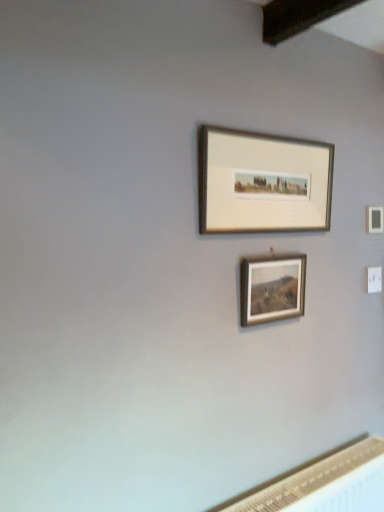
Question: Considering the relative positions of wooden frame at center, the 1th picture frame from the bottom, and silver metallic picture frame at upper center, which ranks as the second picture frame in bottom-to-top order, in the image provided, is wooden frame at center, the 1th picture frame from the bottom, to the right of silver metallic picture frame at upper center, which ranks as the second picture frame in bottom-to-top order, from the viewer's perspective?

Choices:
 (A) no
 (B) yes

Answer: (B)

Question: Is the position of wooden frame at center, the 1th picture frame from the bottom, more distant than that of silver metallic picture frame at upper center, the first picture frame from the top?

Choices:
 (A) no
 (B) yes

Answer: (B)

Question: Is wooden frame at center, the 1th picture frame from the bottom, in contact with silver metallic picture frame at upper center, which ranks as the second picture frame in bottom-to-top order?

Choices:
 (A) yes
 (B) no

Answer: (B)

Question: Is silver metallic picture frame at upper center, the first picture frame from the top, at the back of wooden frame at center, the 2th picture frame positioned from the top?

Choices:
 (A) no
 (B) yes

Answer: (A)

Question: Can you confirm if wooden frame at center, the 2th picture frame positioned from the top, is wider than silver metallic picture frame at upper center, which ranks as the second picture frame in bottom-to-top order?

Choices:
 (A) no
 (B) yes

Answer: (A)

Question: From a real-world perspective, is wooden frame at center, the 2th picture frame positioned from the top, physically located above or below silver metallic picture frame at upper center, the first picture frame from the top?

Choices:
 (A) below
 (B) above

Answer: (A)

Question: Considering the positions of wooden frame at center, the 2th picture frame positioned from the top, and silver metallic picture frame at upper center, the first picture frame from the top, in the image, is wooden frame at center, the 2th picture frame positioned from the top, wider or thinner than silver metallic picture frame at upper center, the first picture frame from the top,?

Choices:
 (A) thin
 (B) wide

Answer: (A)

Question: Is wooden frame at center, the 2th picture frame positioned from the top, taller or shorter than silver metallic picture frame at upper center, which ranks as the second picture frame in bottom-to-top order?

Choices:
 (A) short
 (B) tall

Answer: (A)

Question: Considering the positions of wooden frame at center, the 1th picture frame from the bottom, and silver metallic picture frame at upper center, the first picture frame from the top, in the image, is wooden frame at center, the 1th picture frame from the bottom, bigger or smaller than silver metallic picture frame at upper center, the first picture frame from the top,?

Choices:
 (A) small
 (B) big

Answer: (A)

Question: From the image's perspective, is silver metallic picture frame at upper center, the first picture frame from the top, located above or below white textured radiator at lower right?

Choices:
 (A) below
 (B) above

Answer: (B)

Question: Is point (210, 150) positioned closer to the camera than point (377, 466)?

Choices:
 (A) closer
 (B) farther

Answer: (A)

Question: Is silver metallic picture frame at upper center, which ranks as the second picture frame in bottom-to-top order, to the left or to the right of white textured radiator at lower right in the image?

Choices:
 (A) left
 (B) right

Answer: (A)

Question: From a real-world perspective, is silver metallic picture frame at upper center, the first picture frame from the top, above or below white textured radiator at lower right?

Choices:
 (A) below
 (B) above

Answer: (B)

Question: Considering their positions, is white textured radiator at lower right located in front of or behind wooden frame at center, the 1th picture frame from the bottom?

Choices:
 (A) behind
 (B) front

Answer: (B)

Question: Does point (230, 501) appear closer or farther from the camera than point (301, 273)?

Choices:
 (A) farther
 (B) closer

Answer: (B)